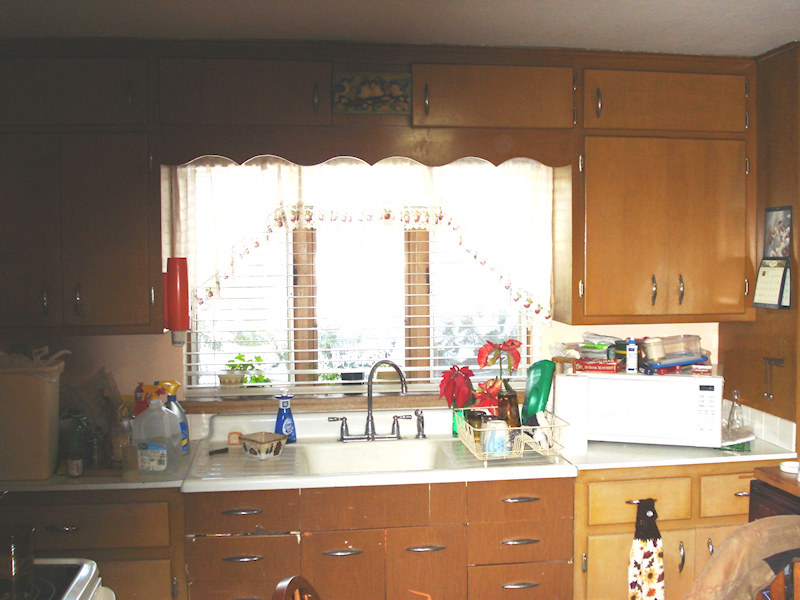
This screenshot has width=800, height=600. In order to click on dish rack in this screenshot , I will do `click(477, 428)`.